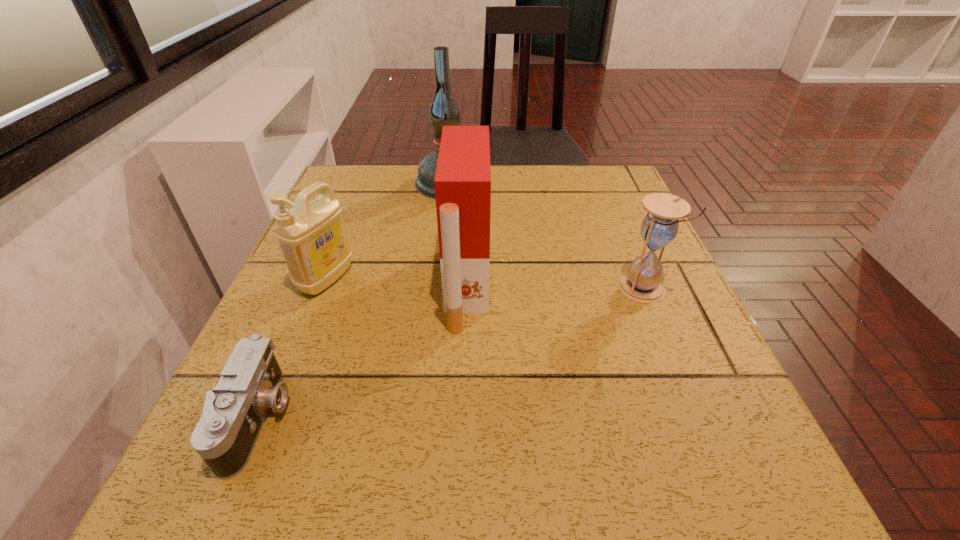
In the image, there is a desktop. Identify the location of vacant space at the left edge. This screenshot has width=960, height=540. (299, 412).

I want to click on vacant space at the right edge, so click(x=599, y=225).

Where is `vacant space at the far left corner of the desktop`? This screenshot has width=960, height=540. vacant space at the far left corner of the desktop is located at coordinates (362, 179).

I want to click on vacant region at the far right corner, so click(583, 187).

You are a GUI agent. You are given a task and a screenshot of the screen. Output one action in this format:
    pyautogui.click(x=<x>, y=<y>)
    Task: Click on the empty location between the second tallest object and the detergent
    The width and height of the screenshot is (960, 540).
    Given the screenshot: What is the action you would take?
    pyautogui.click(x=396, y=282)

At what (x,y) coordinates should I click in order to perform the action: click on vacant area that lies between the tallest object and the rightmost object. Please return your answer as a coordinate pair (x, y). This screenshot has width=960, height=540. Looking at the image, I should click on (545, 236).

In order to click on vacant space in between the nearest object and the detergent in this screenshot , I will do `click(292, 348)`.

At what (x,y) coordinates should I click in order to perform the action: click on free spot between the rightmost object and the tallest object. Please return your answer as a coordinate pair (x, y). Looking at the image, I should click on (545, 236).

At what (x,y) coordinates should I click in order to perform the action: click on vacant area that lies between the tallest object and the camera. Please return your answer as a coordinate pair (x, y). The image size is (960, 540). Looking at the image, I should click on (353, 301).

Find the location of `unoccupied area between the camera and the detergent`. unoccupied area between the camera and the detergent is located at coordinates pyautogui.click(x=292, y=348).